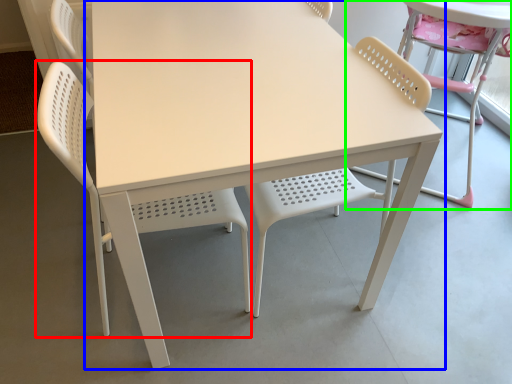
Question: Which object is positioned farthest from chair (highlighted by a red box)? Select from table (highlighted by a blue box) and chair (highlighted by a green box).

Choices:
 (A) table
 (B) chair

Answer: (B)